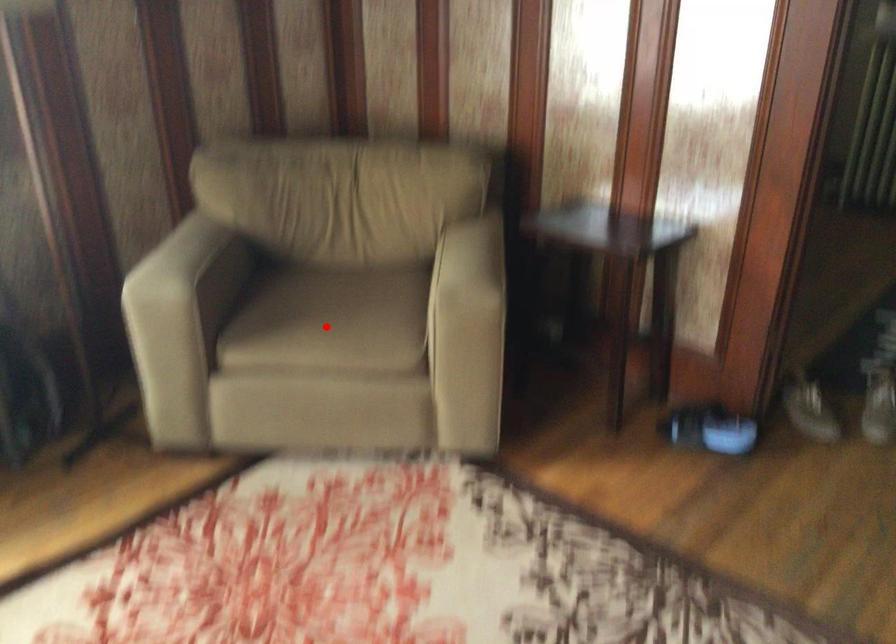
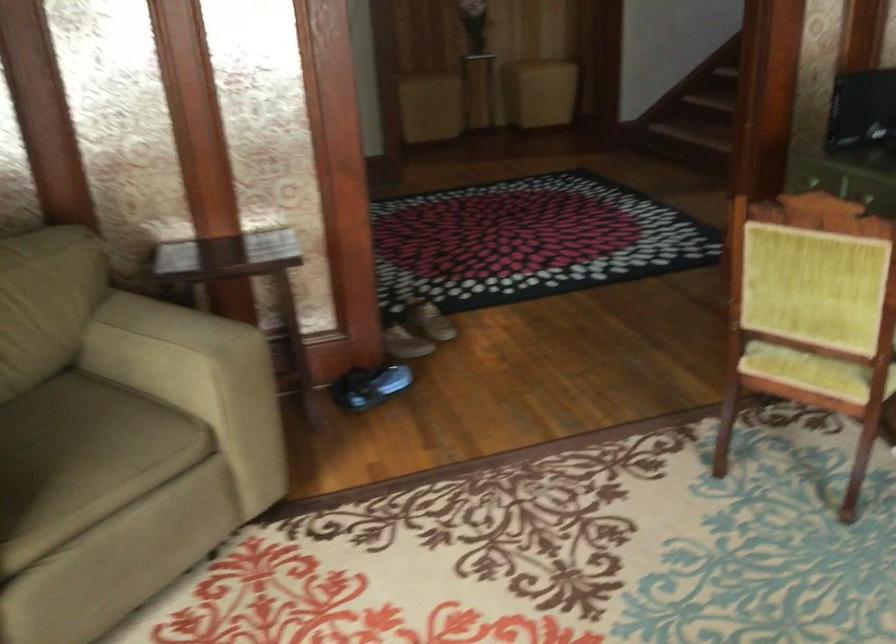
Question: I am providing you with two images of the same scene from different viewpoints. Image1 has a red point marked. In image2, the corresponding 3D location appears at what relative position? Reply with the corresponding letter.

Choices:
 (A) Closer
 (B) Farther

Answer: (A)